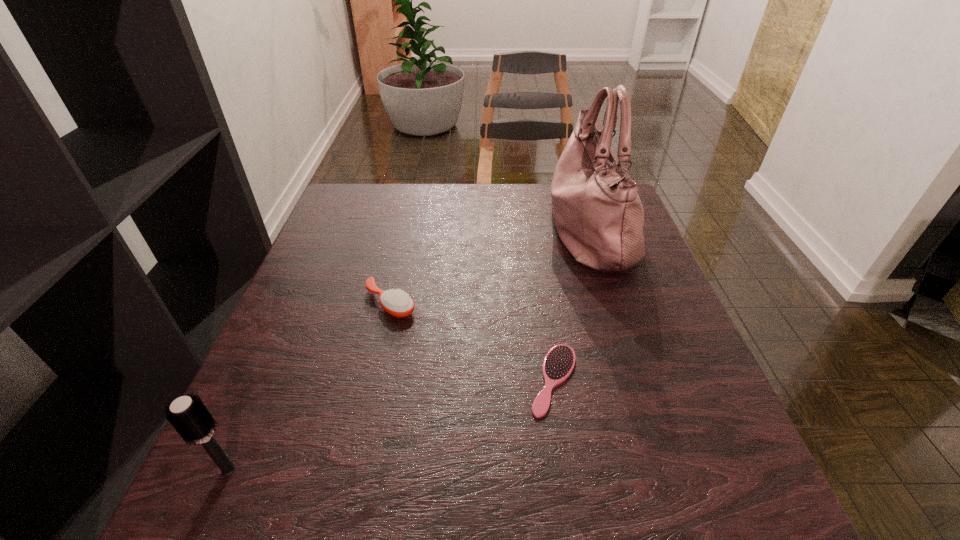
I want to click on free space between the farthest object and the second farthest object, so click(490, 267).

This screenshot has width=960, height=540. I want to click on vacant space that's between the handbag and the nearest object, so click(x=409, y=350).

Find the location of a particular element. The height and width of the screenshot is (540, 960). vacant space in between the second nearest hairbrush and the tallest object is located at coordinates (571, 305).

Image resolution: width=960 pixels, height=540 pixels. I want to click on vacant area that lies between the second farthest hairbrush and the nearest hairbrush, so click(392, 424).

Where is `object identified as the third closest to the farthest object`? object identified as the third closest to the farthest object is located at coordinates (188, 415).

Where is `the closest object to the handbag`? the closest object to the handbag is located at coordinates (559, 362).

This screenshot has height=540, width=960. I want to click on hairbrush object that ranks as the second closest to the shortest hairbrush, so click(188, 415).

Identify which hairbrush is the second closest to the leftmost hairbrush. Please provide its 2D coordinates. Your answer should be formatted as a tuple, i.e. [(x, y)], where the tuple contains the x and y coordinates of a point satisfying the conditions above.

[(559, 362)]